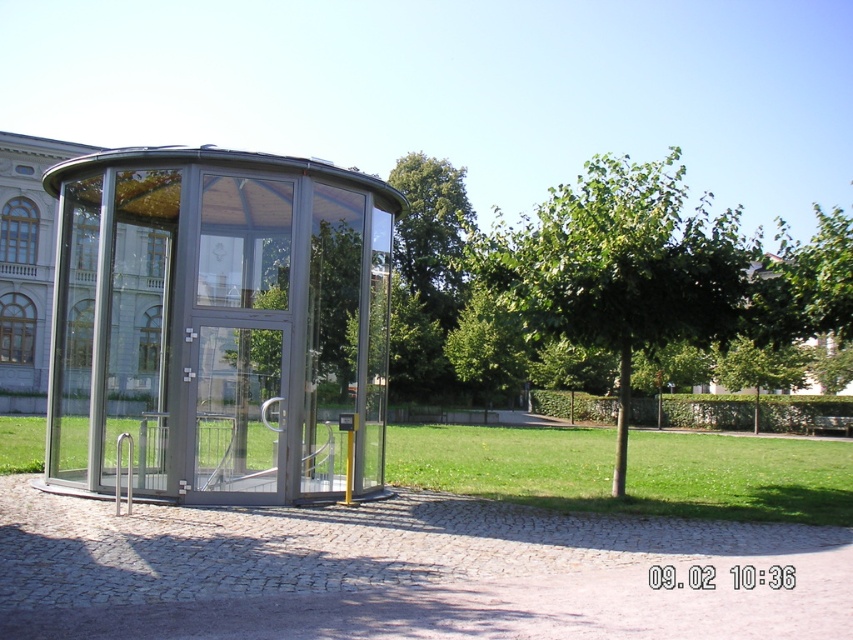
You are standing in the middle of the paved area and want to walk to the entrance of the transparent glass gazebo at center. Which direction should you move relative to the green leafy tree at center?

You should move to the left of the green leafy tree at center because the transparent glass gazebo at center is located to the left of it.